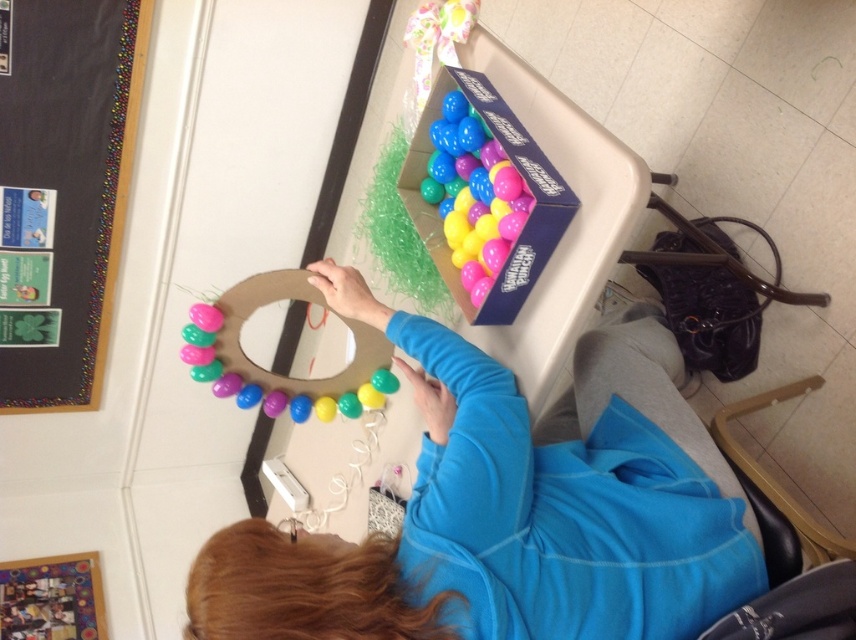
Consider the image. You are organizing a party and see the matte plastic balloons at upper right and the matte pink balloon at upper left on the table. Which balloon is positioned to the right side of the other?

The matte plastic balloons at upper right are to the right of the matte pink balloon at upper left.